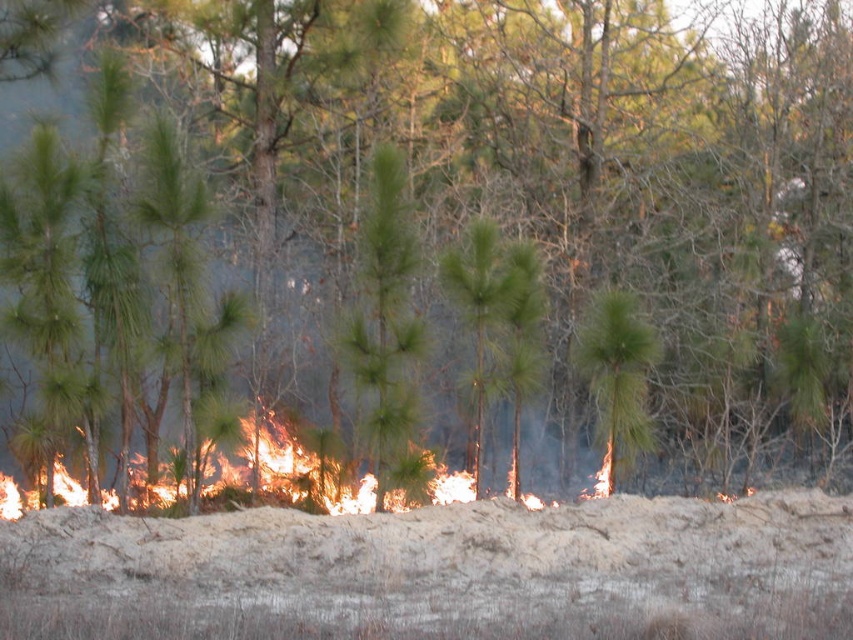
Which of these two, green needle-like at center or flaming flames at center, stands taller?

Standing taller between the two is green needle-like at center.

The image size is (853, 640). Identify the location of green needle-like at center. (387, 328).